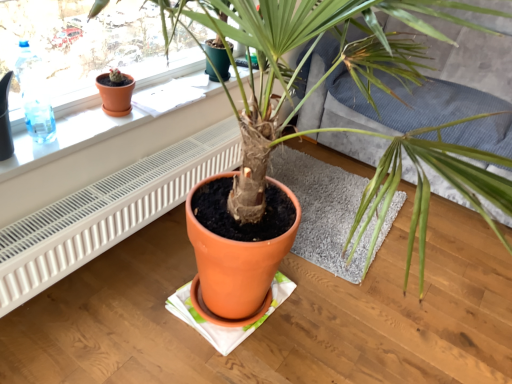
Question: Considering the positions of textured gray couch at center and terracotta pot at center in the image, is textured gray couch at center wider or thinner than terracotta pot at center?

Choices:
 (A) wide
 (B) thin

Answer: (A)

Question: Would you say textured gray couch at center is inside or outside terracotta pot at center?

Choices:
 (A) inside
 (B) outside

Answer: (B)

Question: Based on their relative distances, which object is nearer to the textured gray couch at center?

Choices:
 (A) transparent plastic bottle at upper left
 (B) matte orange flowerpot at upper left
 (C) white plastic radiator at lower left
 (D) terracotta pot at center
 (E) terracotta pot at upper left

Answer: (D)

Question: Estimate the real-world distances between objects in this image. Which object is farther from the transparent plastic bottle at upper left?

Choices:
 (A) white plastic radiator at lower left
 (B) terracotta pot at upper left
 (C) terracotta pot at center
 (D) matte orange flowerpot at upper left
 (E) terracotta pot at center

Answer: (E)